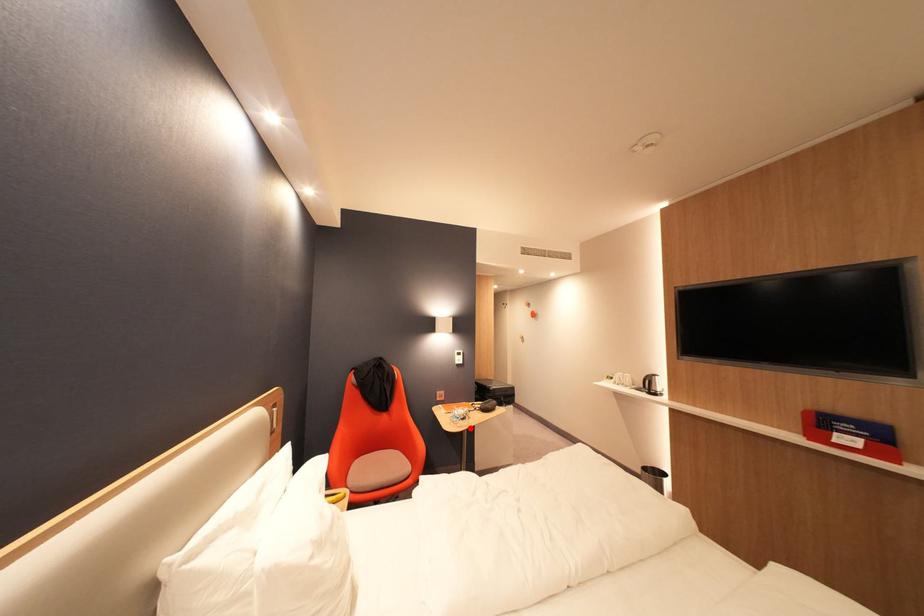
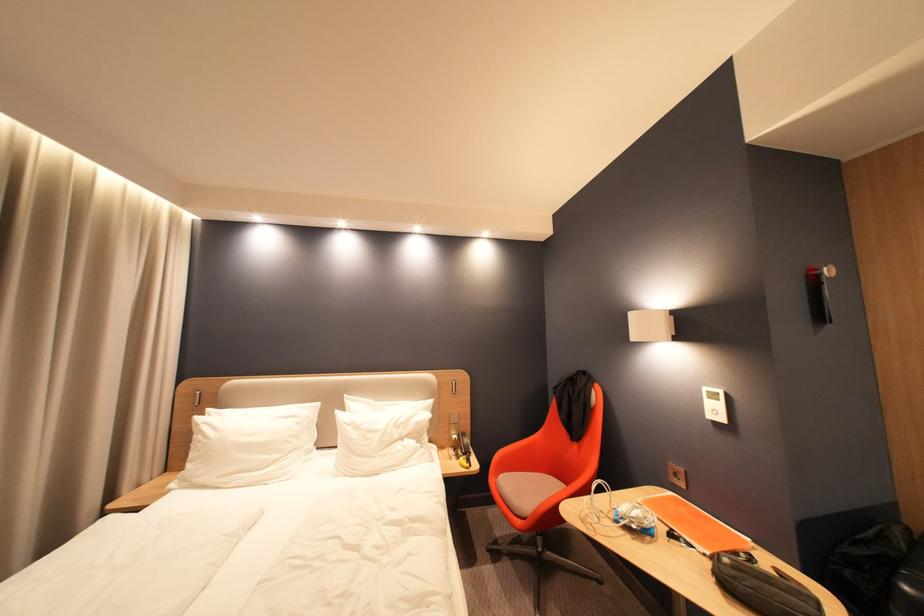
The point at the highlighted location is marked in the first image. Where is the corresponding point in the second image?

(592, 523)